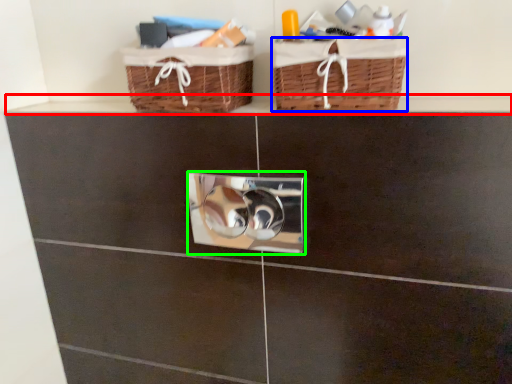
Question: Estimate the real-world distances between objects in this image. Which object is closer to ledge (highlighted by a red box), basket (highlighted by a blue box) or lock (highlighted by a green box)?

Choices:
 (A) basket
 (B) lock

Answer: (B)